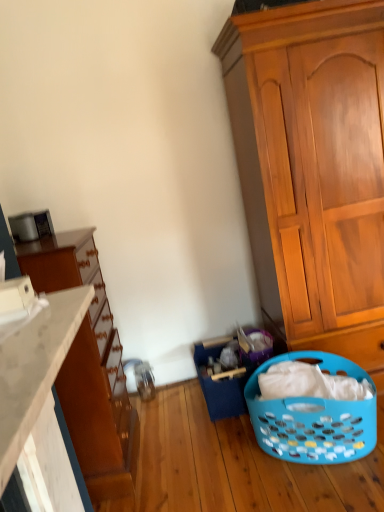
What do you see at coordinates (89, 366) in the screenshot?
I see `matte brown dresser at left` at bounding box center [89, 366].

What is the approximate height of wooden cabinet at right?

wooden cabinet at right is 6.49 feet in height.

Locate an element on the screen. The height and width of the screenshot is (512, 384). white matte countertop at lower left is located at coordinates (34, 369).

Describe the element at coordinates (314, 417) in the screenshot. I see `blue plastic laundry basket at lower right` at that location.

The width and height of the screenshot is (384, 512). Identify the location of matte brown dresser at left. (89, 366).

Considering the relative positions of matte brown dresser at left and wooden cabinet at right in the image provided, is matte brown dresser at left to the right of wooden cabinet at right from the viewer's perspective?

In fact, matte brown dresser at left is to the left of wooden cabinet at right.

Does matte brown dresser at left lie behind wooden cabinet at right?

No, matte brown dresser at left is closer to the camera.

Is there a large distance between matte brown dresser at left and wooden cabinet at right?

Yes.

How distant is matte brown dresser at left from wooden cabinet at right?

A: matte brown dresser at left is 3.60 feet away from wooden cabinet at right.

Considering the relative positions of blue plastic laundry basket at lower right and white matte countertop at lower left in the image provided, is blue plastic laundry basket at lower right to the right of white matte countertop at lower left from the viewer's perspective?

Yes, blue plastic laundry basket at lower right is to the right of white matte countertop at lower left.

Is point (315, 426) less distant than point (70, 294)?

No, it is behind (70, 294).

Considering the relative sizes of blue plastic laundry basket at lower right and white matte countertop at lower left in the image provided, is blue plastic laundry basket at lower right thinner than white matte countertop at lower left?

In fact, blue plastic laundry basket at lower right might be wider than white matte countertop at lower left.

You are a GUI agent. You are given a task and a screenshot of the screen. Output one action in this format:
    pyautogui.click(x=<x>, y=<y>)
    Task: Click on the picnic basket below the white matte countertop at lower left (from the image's perspective)
    The height and width of the screenshot is (512, 384).
    Given the screenshot: What is the action you would take?
    click(314, 417)

This screenshot has width=384, height=512. In order to click on cupboard above the blue plastic laundry basket at lower right (from a real-world perspective) in this screenshot , I will do `click(89, 366)`.

Can you confirm if matte brown dresser at left is shorter than blue plastic laundry basket at lower right?

No, matte brown dresser at left is not shorter than blue plastic laundry basket at lower right.

Which is behind, point (123, 481) or point (282, 425)?

The point (123, 481) is more distant.

Are matte brown dresser at left and blue plastic laundry basket at lower right making contact?

No, matte brown dresser at left is not in contact with blue plastic laundry basket at lower right.

Considering the relative sizes of white matte countertop at lower left and matte brown dresser at left in the image provided, is white matte countertop at lower left smaller than matte brown dresser at left?

Yes.

From the image's perspective, is white matte countertop at lower left located above or below matte brown dresser at left?

Clearly, from the image's perspective, white matte countertop at lower left is above matte brown dresser at left.

Which is closer, (29, 393) or (111, 362)?

Positioned in front is point (29, 393).

Is the surface of white matte countertop at lower left in direct contact with matte brown dresser at left?

There is a gap between white matte countertop at lower left and matte brown dresser at left.

Is wooden cabinet at right oriented towards blue plastic laundry basket at lower right?

Yes, wooden cabinet at right is oriented towards blue plastic laundry basket at lower right.

What are the coordinates of `picnic basket in front of the wooden cabinet at right` in the screenshot? It's located at (314, 417).

Is wooden cabinet at right at the left side of blue plastic laundry basket at lower right?

Incorrect, wooden cabinet at right is not on the left side of blue plastic laundry basket at lower right.

Which object is closer to the camera, white matte countertop at lower left or blue plastic laundry basket at lower right?

white matte countertop at lower left.

Locate an element on the screen. picnic basket lying below the white matte countertop at lower left (from the image's perspective) is located at coordinates (314, 417).

Can you confirm if white matte countertop at lower left is shorter than blue plastic laundry basket at lower right?

Yes, white matte countertop at lower left is shorter than blue plastic laundry basket at lower right.

Visually, is white matte countertop at lower left positioned to the left or to the right of blue plastic laundry basket at lower right?

Based on their positions, white matte countertop at lower left is located to the left of blue plastic laundry basket at lower right.

Would you say white matte countertop at lower left is inside or outside wooden cabinet at right?

white matte countertop at lower left is spatially situated outside wooden cabinet at right.

Does point (2, 434) come farther from viewer compared to point (277, 57)?

No, it is in front of (277, 57).

Which of these two, white matte countertop at lower left or wooden cabinet at right, stands taller?

Standing taller between the two is wooden cabinet at right.

From the image's perspective, does white matte countertop at lower left appear higher than wooden cabinet at right?

No, from the image's perspective, white matte countertop at lower left is not over wooden cabinet at right.

Locate an element on the screen. cabinetry on the right of matte brown dresser at left is located at coordinates pyautogui.click(x=313, y=169).

This screenshot has width=384, height=512. In order to click on countertop positioned vertically above the blue plastic laundry basket at lower right (from a real-world perspective) in this screenshot , I will do `click(34, 369)`.

Looking at the image, which one is located closer to blue plastic laundry basket at lower center, white matte countertop at lower left or matte brown dresser at left?

Among the two, matte brown dresser at left is located nearer to blue plastic laundry basket at lower center.

From the image, which object appears to be nearer to wooden cabinet at right, blue plastic laundry basket at lower center or matte brown dresser at left?

blue plastic laundry basket at lower center is closer to wooden cabinet at right.

Based on their spatial positions, is white matte countertop at lower left or blue plastic laundry basket at lower center further from blue plastic laundry basket at lower right?

Based on the image, white matte countertop at lower left appears to be further to blue plastic laundry basket at lower right.

When comparing their distances from matte brown dresser at left, does white matte countertop at lower left or blue plastic laundry basket at lower center seem closer?

blue plastic laundry basket at lower center lies closer to matte brown dresser at left than the other object.

Looking at the image, which one is located closer to blue plastic laundry basket at lower center, matte brown dresser at left or wooden cabinet at right?

matte brown dresser at left.

Considering their positions, is matte brown dresser at left positioned closer to blue plastic laundry basket at lower center than blue plastic laundry basket at lower right?

blue plastic laundry basket at lower right lies closer to blue plastic laundry basket at lower center than the other object.

From the image, which object appears to be nearer to matte brown dresser at left, white matte countertop at lower left or wooden cabinet at right?

Among the two, white matte countertop at lower left is located nearer to matte brown dresser at left.

Based on their spatial positions, is blue plastic laundry basket at lower center or matte brown dresser at left closer to white matte countertop at lower left?

The object closer to white matte countertop at lower left is matte brown dresser at left.

Identify the location of basket situated between matte brown dresser at left and wooden cabinet at right from left to right. (220, 382).

The width and height of the screenshot is (384, 512). Find the location of `picnic basket between white matte countertop at lower left and blue plastic laundry basket at lower center along the z-axis`. picnic basket between white matte countertop at lower left and blue plastic laundry basket at lower center along the z-axis is located at coordinates (314, 417).

The width and height of the screenshot is (384, 512). Find the location of `picnic basket located between white matte countertop at lower left and matte brown dresser at left in the depth direction`. picnic basket located between white matte countertop at lower left and matte brown dresser at left in the depth direction is located at coordinates click(x=314, y=417).

This screenshot has height=512, width=384. Identify the location of cabinetry located between white matte countertop at lower left and blue plastic laundry basket at lower center in the depth direction. (313, 169).